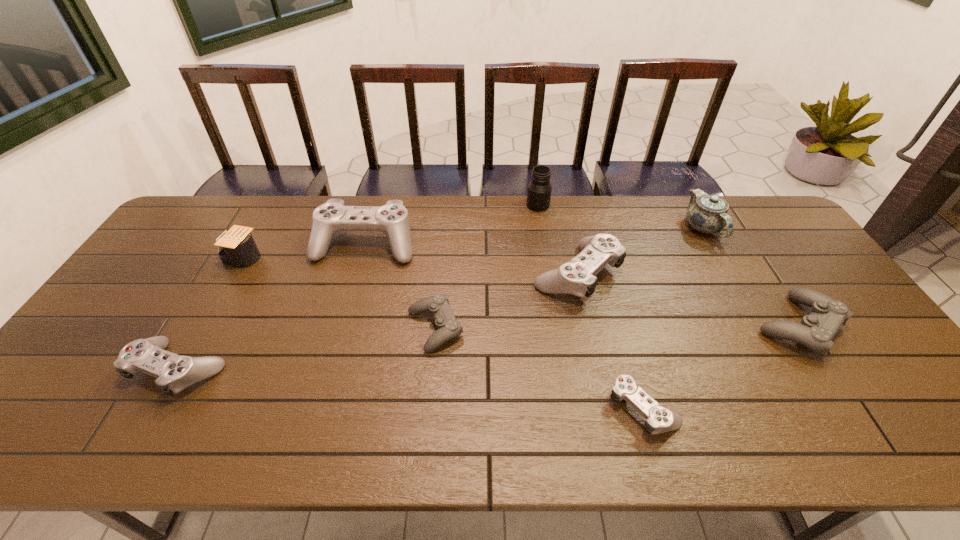
This screenshot has height=540, width=960. Find the location of `vacant area situated on the front of the fourth control from right to left`. vacant area situated on the front of the fourth control from right to left is located at coordinates (423, 453).

Find the location of a particular element. This screenshot has height=540, width=960. vacant point located 0.300m on the right of the smallest white control is located at coordinates (805, 406).

At what (x,y) coordinates should I click in order to perform the action: click on jar present at the far edge. Please return your answer as a coordinate pair (x, y). This screenshot has width=960, height=540. Looking at the image, I should click on (539, 191).

Find the location of a particular element. This screenshot has width=960, height=540. chinaware at the far edge is located at coordinates (706, 213).

Find the location of a particular element. control that is at the far edge is located at coordinates coord(392,219).

Where is `object present at the near edge`? The height and width of the screenshot is (540, 960). object present at the near edge is located at coordinates (659, 419).

Identify the location of object at the right edge. (816, 331).

This screenshot has width=960, height=540. I want to click on vacant space at the far edge of the desktop, so click(309, 213).

Where is `vacant space at the near edge of the desktop`? This screenshot has width=960, height=540. vacant space at the near edge of the desktop is located at coordinates (810, 442).

The height and width of the screenshot is (540, 960). In the image, there is a desktop. Find the location of `free region at the right edge`. free region at the right edge is located at coordinates (757, 254).